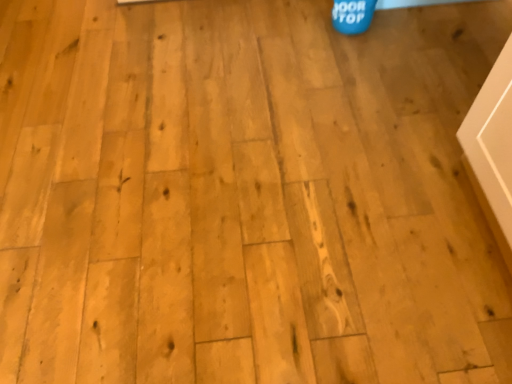
In order to click on free space in front of blue rubber door stop at upper right in this screenshot , I will do `click(355, 49)`.